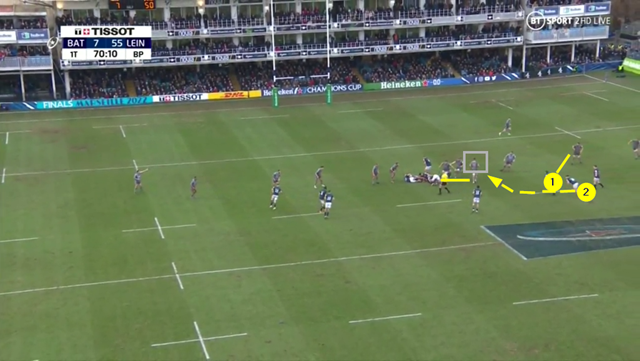
The image size is (640, 361). What are the coordinates of `stands` in the screenshot? It's located at (196, 63), (502, 59), (237, 19), (416, 15), (86, 79), (33, 54).